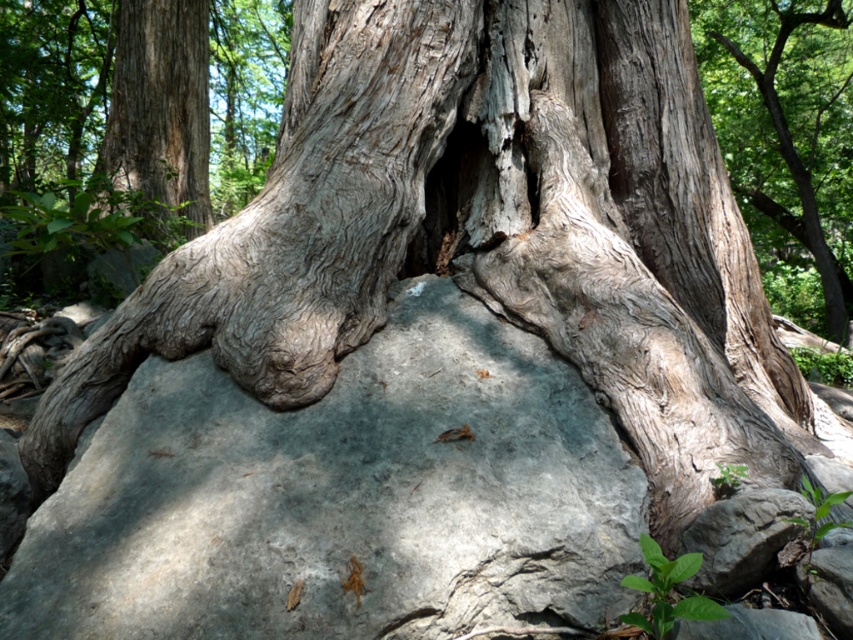
You are standing in front of the tree trunk and rock scene. There are two points marked on the image. The first point is at coordinates point [500,576] and the second is at point [753,77]. Which point is closer to you?

Point [500,576] is closer to the viewer than point [753,77].